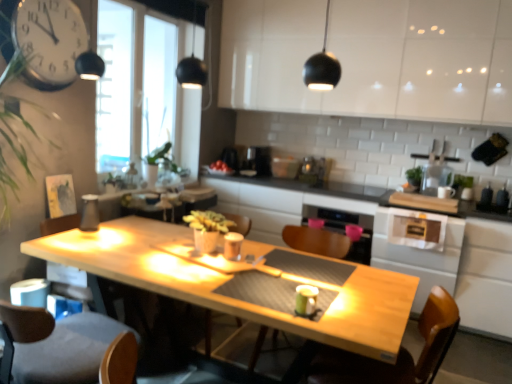
I want to click on transparent glass window at upper left, so click(134, 84).

This screenshot has width=512, height=384. What do you see at coordinates (134, 84) in the screenshot? I see `transparent glass window at upper left` at bounding box center [134, 84].

Describe the element at coordinates (259, 160) in the screenshot. This screenshot has width=512, height=384. I see `black plastic coffee machine at center` at that location.

What do you see at coordinates (58, 344) in the screenshot? Image resolution: width=512 pixels, height=384 pixels. I see `dark brown leather swivel chair at lower left, which is the first swivel chair from left to right` at bounding box center [58, 344].

What do you see at coordinates (115, 181) in the screenshot? The image size is (512, 384). I see `green leafy plant at upper left` at bounding box center [115, 181].

Locate an element on the screen. The height and width of the screenshot is (384, 512). transparent glass window at upper left is located at coordinates (134, 84).

From the image's perspective, is metallic silver toaster at upper center, the third appliance viewed from the front, below dark brown leather swivel chair at lower left, which is the first swivel chair from left to right?

Actually, metallic silver toaster at upper center, the third appliance viewed from the front, appears above dark brown leather swivel chair at lower left, which is the first swivel chair from left to right, in the image.

Is metallic silver toaster at upper center, which is counted as the first appliance, starting from the back, next to dark brown leather swivel chair at lower left, the second swivel chair viewed from the right?

No, metallic silver toaster at upper center, which is counted as the first appliance, starting from the back, is not beside dark brown leather swivel chair at lower left, the second swivel chair viewed from the right.

Based on the photo, between metallic silver toaster at upper center, the second appliance from the left, and dark brown leather swivel chair at lower left, the second swivel chair viewed from the right, which one is positioned behind?

metallic silver toaster at upper center, the second appliance from the left, is further from the camera.

Is metallic silver toaster at upper center, acting as the 1th appliance starting from the top, bigger or smaller than dark brown leather swivel chair at lower left, the second swivel chair viewed from the right?

In the image, metallic silver toaster at upper center, acting as the 1th appliance starting from the top, appears to be smaller than dark brown leather swivel chair at lower left, the second swivel chair viewed from the right.

Consider the image. Is matte glass carafe at left, the 1th appliance when ordered from front to back, thinner than wooden swivel chair at lower right, acting as the 1th swivel chair starting from the right?

Correct, the width of matte glass carafe at left, the 1th appliance when ordered from front to back, is less than that of wooden swivel chair at lower right, acting as the 1th swivel chair starting from the right.

How many degrees apart are the facing directions of matte glass carafe at left, the first appliance in the left-to-right sequence, and wooden swivel chair at lower right, acting as the 1th swivel chair starting from the right?

The angular difference between matte glass carafe at left, the first appliance in the left-to-right sequence, and wooden swivel chair at lower right, acting as the 1th swivel chair starting from the right, is 180 degrees.

Considering the sizes of objects matte glass carafe at left, positioned as the 3th appliance in back-to-front order, and wooden swivel chair at lower right, acting as the 1th swivel chair starting from the right, in the image provided, who is smaller, matte glass carafe at left, positioned as the 3th appliance in back-to-front order, or wooden swivel chair at lower right, acting as the 1th swivel chair starting from the right,?

matte glass carafe at left, positioned as the 3th appliance in back-to-front order, is smaller.

Is matte glass carafe at left, the first appliance in the left-to-right sequence, in front of wooden swivel chair at lower right, acting as the second swivel chair starting from the left?

No, matte glass carafe at left, the first appliance in the left-to-right sequence, is further to the viewer.

Is metallic silver toaster at upper center, which is counted as the first appliance, starting from the back, a part of metallic silver clock at upper left?

Definitely not — metallic silver toaster at upper center, which is counted as the first appliance, starting from the back, is not inside metallic silver clock at upper left.

In the scene shown: Considering the sizes of objects metallic silver clock at upper left and metallic silver toaster at upper center, positioned as the 3th appliance in bottom-to-top order, in the image provided, who is taller, metallic silver clock at upper left or metallic silver toaster at upper center, positioned as the 3th appliance in bottom-to-top order,?

Standing taller between the two is metallic silver clock at upper left.

Which is more to the left, metallic silver clock at upper left or metallic silver toaster at upper center, the third appliance viewed from the front?

metallic silver clock at upper left is more to the left.

Which object is wider, metallic silver clock at upper left or metallic silver toaster at upper center, positioned as the 3th appliance in bottom-to-top order?

With larger width is metallic silver toaster at upper center, positioned as the 3th appliance in bottom-to-top order.

Is matte glass carafe at left, the first appliance in the left-to-right sequence, completely or partially inside black plastic coffee machine at center?

Actually, matte glass carafe at left, the first appliance in the left-to-right sequence, is outside black plastic coffee machine at center.

Does black plastic coffee machine at center have a greater width compared to matte glass carafe at left, the first appliance in the left-to-right sequence?

Correct, the width of black plastic coffee machine at center exceeds that of matte glass carafe at left, the first appliance in the left-to-right sequence.

Which object is positioned more to the left, black plastic coffee machine at center or matte glass carafe at left, positioned as the 3th appliance in back-to-front order?

From the viewer's perspective, matte glass carafe at left, positioned as the 3th appliance in back-to-front order, appears more on the left side.

Consider the image. Based on their sizes in the image, would you say wooden armchair at center, the second armchair in the left-to-right sequence, is bigger or smaller than wooden table at center?

Considering their sizes, wooden armchair at center, the second armchair in the left-to-right sequence, takes up less space than wooden table at center.

Could you tell me if wooden armchair at center, the second armchair in the left-to-right sequence, is facing wooden table at center?

No, wooden armchair at center, the second armchair in the left-to-right sequence, is not oriented towards wooden table at center.

Which object is more forward, wooden armchair at center, the second armchair in the left-to-right sequence, or wooden table at center?

wooden armchair at center, the second armchair in the left-to-right sequence, is in front.

Is transparent glass window at upper left at the left side of metallic silver clock at upper left?

In fact, transparent glass window at upper left is to the right of metallic silver clock at upper left.

Which object is thinner, transparent glass window at upper left or metallic silver clock at upper left?

With smaller width is metallic silver clock at upper left.

Is transparent glass window at upper left bigger or smaller than metallic silver clock at upper left?

Clearly, transparent glass window at upper left is larger in size than metallic silver clock at upper left.

From the image's perspective, relative to metallic silver clock at upper left, is transparent glass window at upper left above or below?

Clearly, from the image's perspective, transparent glass window at upper left is below metallic silver clock at upper left.

Locate an element on the screen. the 2nd swivel chair in front of the metallic silver clock at upper left is located at coordinates [58, 344].

In terms of height, does dark brown leather swivel chair at lower left, the second swivel chair viewed from the right, look taller or shorter compared to metallic silver clock at upper left?

Clearly, dark brown leather swivel chair at lower left, the second swivel chair viewed from the right, is taller compared to metallic silver clock at upper left.

How far apart are dark brown leather swivel chair at lower left, the second swivel chair viewed from the right, and metallic silver clock at upper left?

dark brown leather swivel chair at lower left, the second swivel chair viewed from the right, and metallic silver clock at upper left are 1.25 meters apart.

From the picture: From the image's perspective, would you say dark brown leather swivel chair at lower left, which is the first swivel chair from left to right, is shown under metallic silver clock at upper left?

Yes, from the image's perspective, dark brown leather swivel chair at lower left, which is the first swivel chair from left to right, is beneath metallic silver clock at upper left.

The height and width of the screenshot is (384, 512). In order to click on the 2nd swivel chair directly beneath the metallic silver toaster at upper center, the third appliance viewed from the front (from a real-world perspective) in this screenshot , I will do `click(58, 344)`.

Image resolution: width=512 pixels, height=384 pixels. Identify the location of the 2nd swivel chair below the matte glass carafe at left, the first appliance in the bottom-to-top sequence (from the image's perspective). (398, 353).

Which object lies nearer to the anchor point matte glass carafe at left, the first appliance in the left-to-right sequence, black plastic coffee machine at center or wooden swivel chair at lower right, acting as the 1th swivel chair starting from the right?

The object closer to matte glass carafe at left, the first appliance in the left-to-right sequence, is wooden swivel chair at lower right, acting as the 1th swivel chair starting from the right.

Looking at the image, which one is located further to wooden armchair at center, the 1th armchair positioned from the left, transparent glass window at upper left or metallic silver clock at upper left?

transparent glass window at upper left is further to wooden armchair at center, the 1th armchair positioned from the left.

When comparing their distances from white glossy cabinet at upper center, does dark brown leather swivel chair at lower left, which is the first swivel chair from left to right, or wooden table at center seem closer?

wooden table at center is positioned closer to the anchor white glossy cabinet at upper center.

Estimate the real-world distances between objects in this image. Which object is further from wooden table at center, satin silver toaster at center, placed as the third appliance when sorted from left to right, or wooden swivel chair at lower right, acting as the second swivel chair starting from the left?

Based on the image, wooden swivel chair at lower right, acting as the second swivel chair starting from the left, appears to be further to wooden table at center.

Which object lies nearer to the anchor point wooden swivel chair at lower right, acting as the second swivel chair starting from the left, metallic silver clock at upper left or satin silver toaster at center, the 1th appliance positioned from the right?

metallic silver clock at upper left is positioned closer to the anchor wooden swivel chair at lower right, acting as the second swivel chair starting from the left.

Looking at the image, which one is located closer to wooden swivel chair at lower right, acting as the second swivel chair starting from the left, transparent glass window at upper left or wooden armchair at center, the 1th armchair positioned from the left?

wooden armchair at center, the 1th armchair positioned from the left, is positioned closer to the anchor wooden swivel chair at lower right, acting as the second swivel chair starting from the left.

Based on the photo, which object lies nearer to the anchor point wooden table at center, black plastic coffee machine at center or white glossy cabinet at upper center?

Based on the image, black plastic coffee machine at center appears to be nearer to wooden table at center.

In the scene shown: From the image, which object appears to be farther from metallic silver toaster at upper center, which is counted as the first appliance, starting from the back, wooden armchair at center, which is the 1th armchair from right to left, or matte glass carafe at left, the 1th appliance when ordered from front to back?

The object further to metallic silver toaster at upper center, which is counted as the first appliance, starting from the back, is matte glass carafe at left, the 1th appliance when ordered from front to back.

I want to click on coffee machine located between transparent glass window at upper left and metallic silver toaster at upper center, acting as the 1th appliance starting from the top, in the depth direction, so click(259, 160).

The height and width of the screenshot is (384, 512). Identify the location of appliance between wooden armchair at center, which is the 1th armchair from right to left, and black plastic coffee machine at center from front to back. (90, 213).

This screenshot has width=512, height=384. In order to click on appliance located between matte glass carafe at left, the first appliance in the bottom-to-top sequence, and metallic silver toaster at upper center, the third appliance viewed from the front, in the depth direction in this screenshot , I will do `click(312, 171)`.

Locate an element on the screen. cabinetry positioned between wooden swivel chair at lower right, acting as the 1th swivel chair starting from the right, and metallic silver toaster at upper center, positioned as the 3th appliance in bottom-to-top order, from near to far is located at coordinates (372, 58).